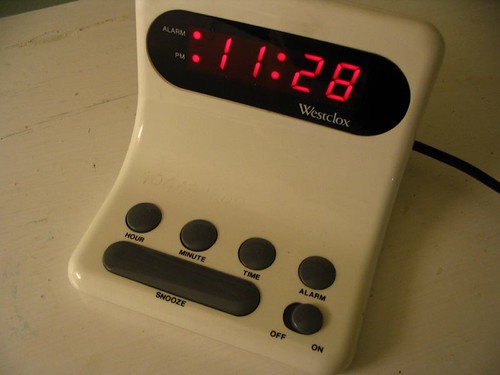
Find the location of a particular element. Image resolution: width=500 pixels, height=375 pixels. white alarm clock is located at coordinates (299, 194).